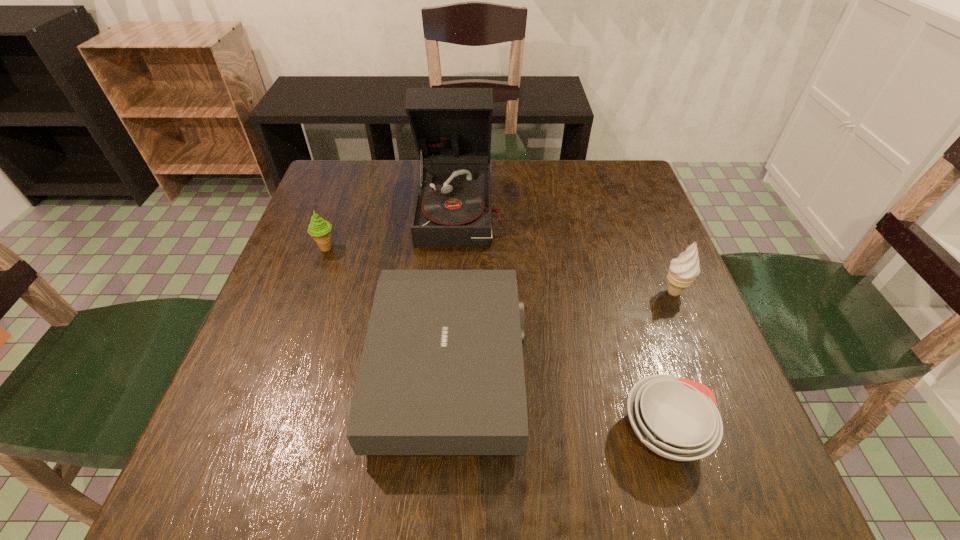
Image resolution: width=960 pixels, height=540 pixels. I want to click on soup bowl that is positioned at the right edge, so click(677, 418).

You are a GUI agent. You are given a task and a screenshot of the screen. Output one action in this format:
    pyautogui.click(x=<x>, y=<y>)
    Task: Click on the object that is at the near right corner
    
    Given the screenshot: What is the action you would take?
    pyautogui.click(x=677, y=418)

The width and height of the screenshot is (960, 540). I want to click on blank space at the far edge of the desktop, so click(x=408, y=199).

Where is `free region at the near edge of the desktop`? free region at the near edge of the desktop is located at coordinates (588, 451).

Locate an element on the screen. The width and height of the screenshot is (960, 540). free space at the left edge of the desktop is located at coordinates (302, 252).

Image resolution: width=960 pixels, height=540 pixels. In the image, there is a desktop. In order to click on vacant region at the right edge in this screenshot , I will do `click(656, 350)`.

Where is `vacant area at the far left corner`? The width and height of the screenshot is (960, 540). vacant area at the far left corner is located at coordinates (355, 206).

The image size is (960, 540). What are the coordinates of `vacant space at the near left corner of the desktop` in the screenshot? It's located at (213, 462).

In order to click on free point at the far right corner in this screenshot , I will do `click(595, 171)`.

Where is `vacant space at the near right corner`? This screenshot has width=960, height=540. vacant space at the near right corner is located at coordinates point(775,485).